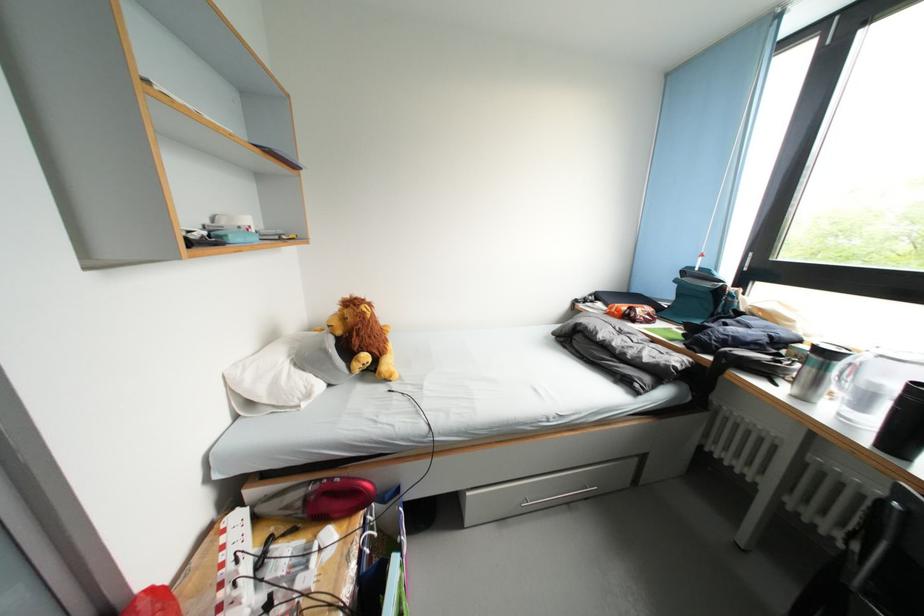
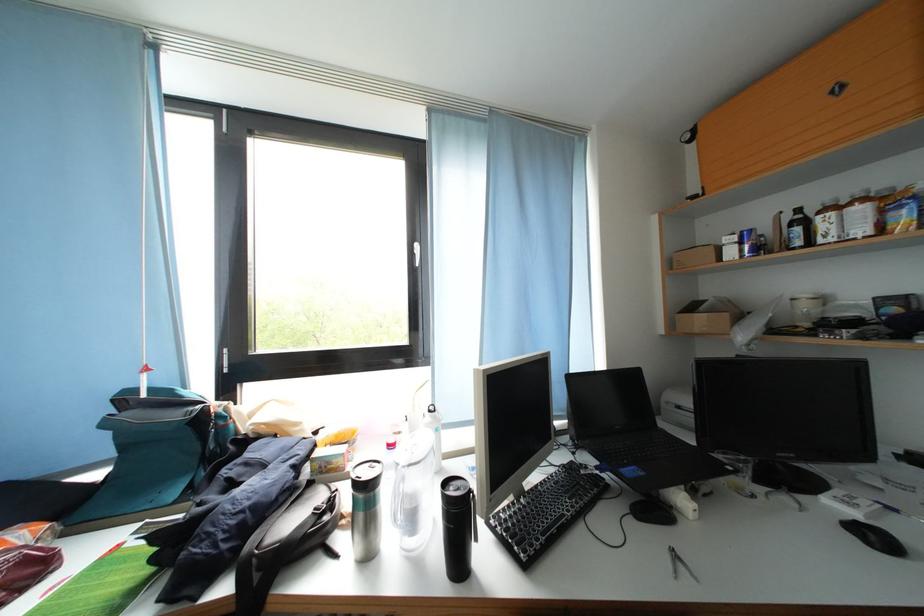
Question: How did the camera likely rotate?

Choices:
 (A) Left
 (B) Right
 (C) Up
 (D) Down

Answer: (B)